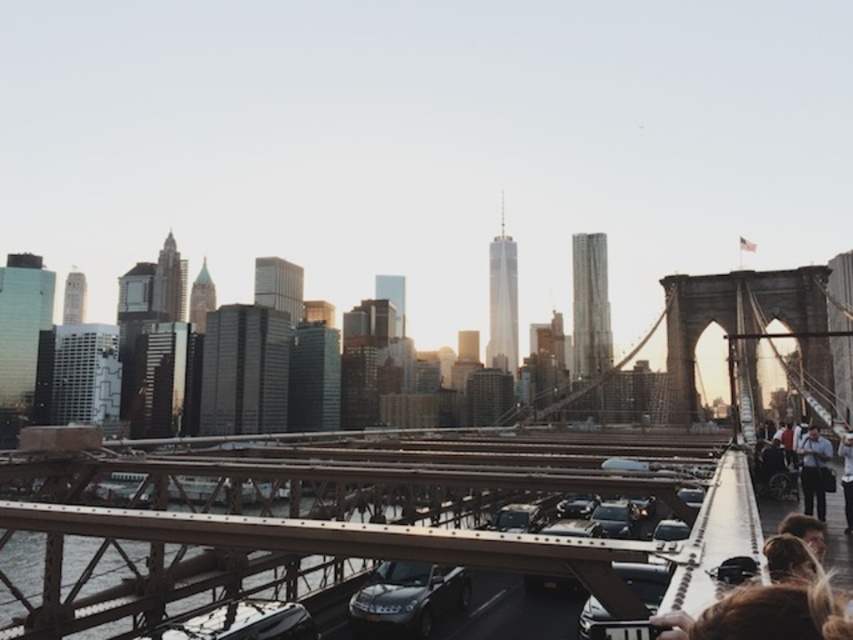
Question: Can you confirm if blonde hair at lower right is bigger than dark blue jeans at right?

Choices:
 (A) yes
 (B) no

Answer: (B)

Question: Does shiny black car at center have a larger size compared to light blue shirt at right?

Choices:
 (A) no
 (B) yes

Answer: (A)

Question: Can you confirm if shiny black car at center is positioned above blonde hair at lower right?

Choices:
 (A) yes
 (B) no

Answer: (B)

Question: Which point is closer to the camera?

Choices:
 (A) metallic gray sedan at center
 (B) shiny silver car at center
 (C) metallic brown bridge at center
 (D) brown wooden suspension bridge at center

Answer: (D)

Question: Among these points, which one is nearest to the camera?

Choices:
 (A) (827, 449)
 (B) (225, 604)
 (C) (296, 456)
 (D) (448, 595)

Answer: (B)

Question: Which object appears closest to the camera in this image?

Choices:
 (A) shiny black car at center
 (B) brown wooden suspension bridge at center
 (C) metallic brown bridge at center

Answer: (B)